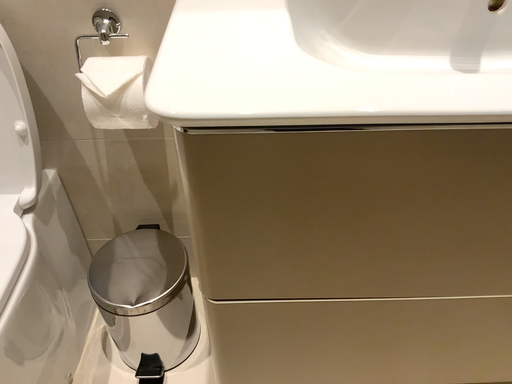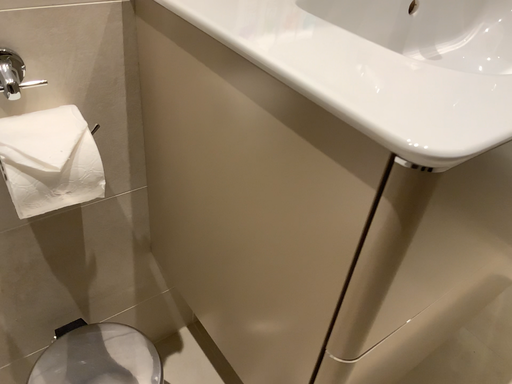
Question: How did the camera likely rotate when shooting the video?

Choices:
 (A) rotated right
 (B) rotated left

Answer: (A)